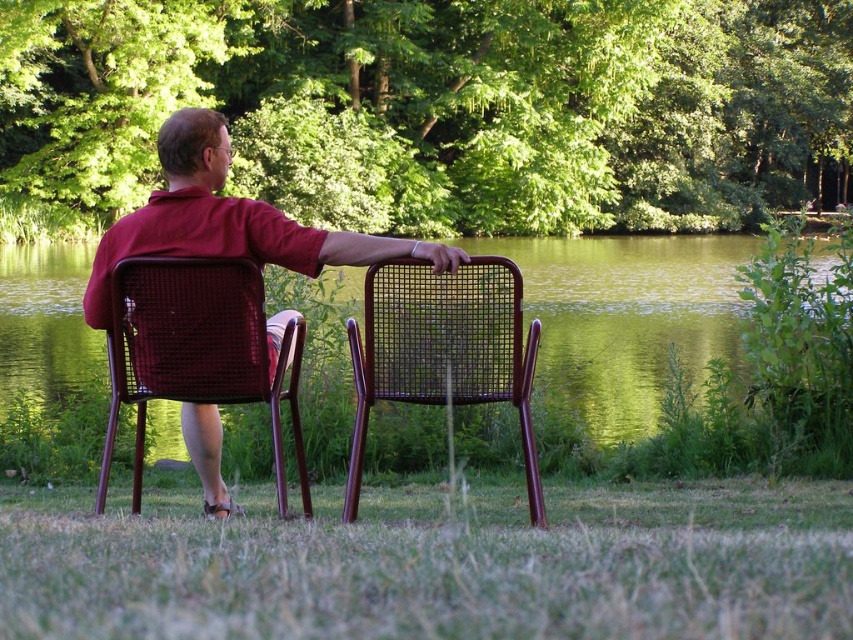
You are planning to place a rectangular picnic blanket between the green wavy water at center and the matte wicker chair at center. The blanket is 2 meters wide. Can the blanket fit horizontally between them without overlapping either object?

The green wavy water at center is wider than the matte wicker chair at center. However, since the exact distance between them isn not provided, we cannot determine if the 2m blanket will fit. The question requires knowing the space between, not just the width of the objects themselves.

You are planning to sit on one of the chairs in the scene. Which chair, the matte wicker chair at center or the brown wicker chair at center, has a wider seat to accommodate your legs?

The brown wicker chair at center has a greater width than the matte wicker chair at center, so it would provide a wider seat for your legs.